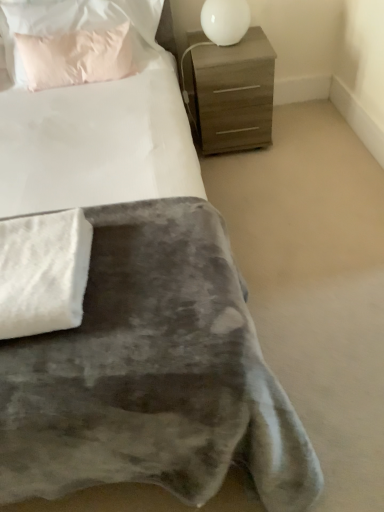
Locate an element on the screen. vacant space to the right of white fluffy blanket at lower left is located at coordinates (138, 282).